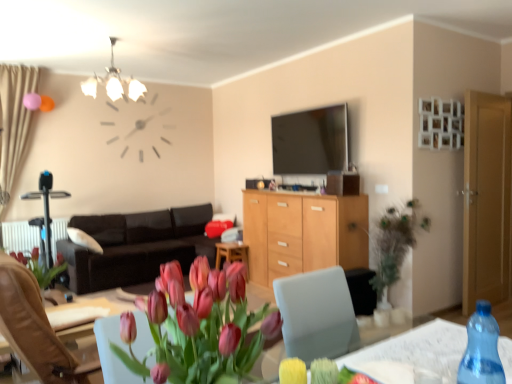
Question: Based on their positions, is transparent plastic bottle at lower right located to the left or right of matte pink tulips at center?

Choices:
 (A) left
 (B) right

Answer: (B)

Question: From a real-world perspective, relative to matte pink tulips at center, is transparent plastic bottle at lower right vertically above or below?

Choices:
 (A) above
 (B) below

Answer: (B)

Question: Considering the real-world distances, which object is farthest from the beige fabric curtain at left?

Choices:
 (A) matte glass chandelier at upper center
 (B) blue translucent bottle at lower right
 (C) light brown wooden door at right
 (D) dark brown leather couch at center
 (E) wooden cabinet at center

Answer: (B)

Question: Based on their relative distances, which object is nearer to the transparent plastic bottle at lower right?

Choices:
 (A) dark brown leather couch at center
 (B) matte pink tulips at center
 (C) green leafy plant at right
 (D) beige fabric curtain at left
 (E) white plastic radiator at lower left

Answer: (B)